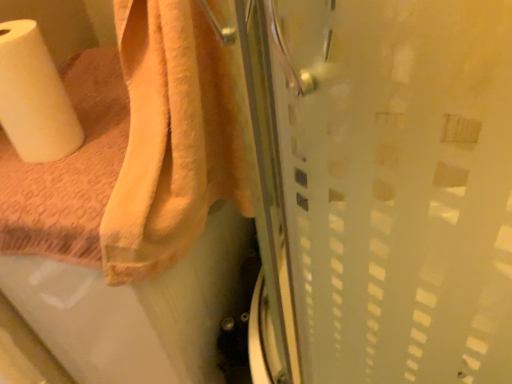
Find the location of a particular element. This screenshot has height=384, width=512. vacant space to the right of white matte paper towel at left is located at coordinates (106, 135).